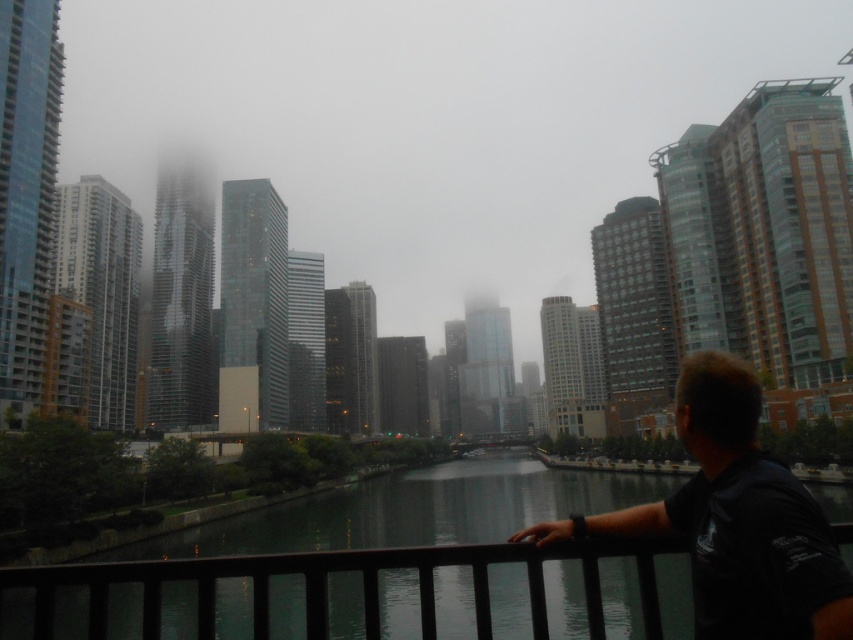
Question: Can you confirm if dark glass water at center is positioned below black matte shirt at lower right?

Choices:
 (A) yes
 (B) no

Answer: (A)

Question: Is dark glass water at center bigger than black matte shirt at lower right?

Choices:
 (A) yes
 (B) no

Answer: (A)

Question: Which point appears farthest from the camera in this image?

Choices:
 (A) (728, 593)
 (B) (68, 604)

Answer: (B)

Question: Is dark glass water at center above black matte shirt at lower right?

Choices:
 (A) no
 (B) yes

Answer: (A)